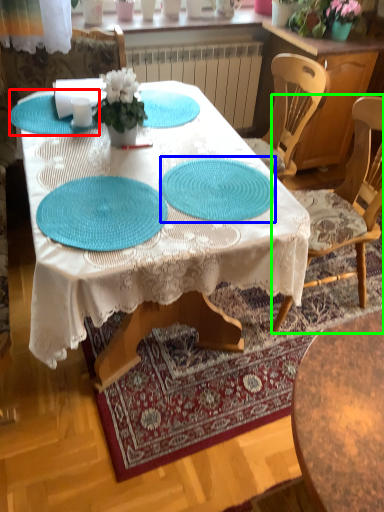
Question: Which object is the closest to the glass plate (highlighted by a red box)? Choose among these: glass plate (highlighted by a blue box) or chair (highlighted by a green box).

Choices:
 (A) glass plate
 (B) chair

Answer: (A)